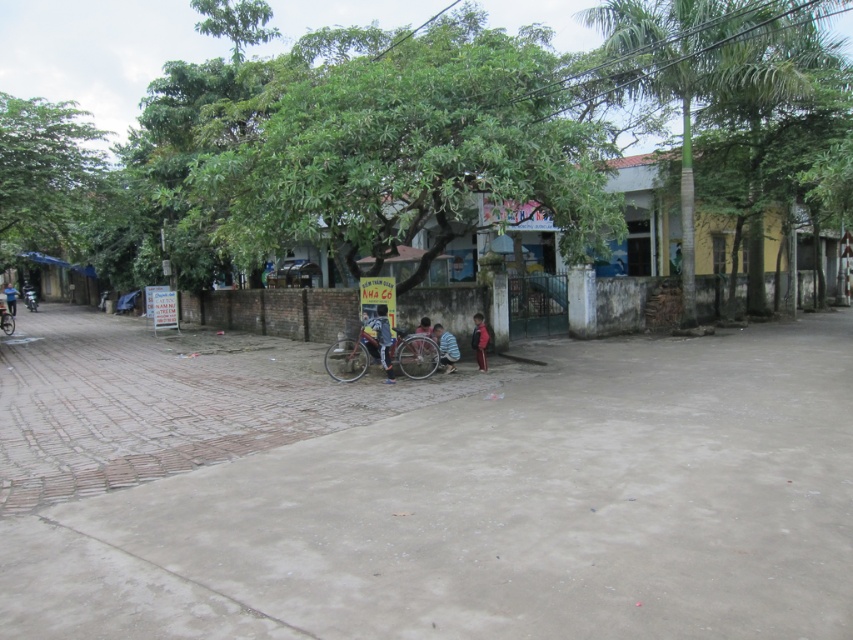
You are a pedestrian walking along the brick path and see a green leafy tree at upper center and a striped shirt at center. Which object is located more to the right side of the scene?

The green leafy tree at upper center is located more to the right side of the scene compared to the striped shirt at center.

You are a photographer trying to capture a photo of the striped fabric shirt at center without the green leafy tree at upper center appearing in the background. Is the tree likely to block the view of the shirt?

The green leafy tree at upper center is much taller than the striped fabric shirt at center, so it might block the view depending on the angle. However, since the shirt is at center and the tree is also at upper center, adjusting the camera angle slightly downward could avoid the tree obstructing the shirt.